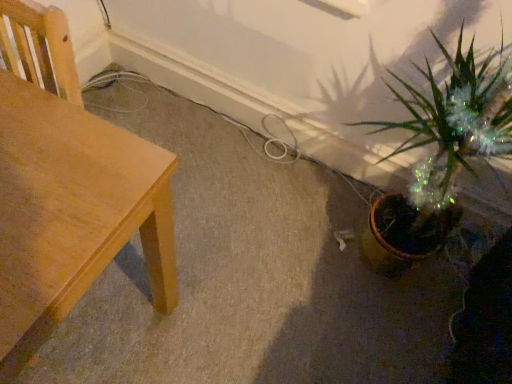
Find the location of a particular element. This screenshot has width=512, height=384. light brown wood table at left is located at coordinates (72, 212).

What do you see at coordinates (72, 212) in the screenshot? I see `light brown wood table at left` at bounding box center [72, 212].

At what (x,y) coordinates should I click in order to perform the action: click on light brown wood table at left. Please return your answer as a coordinate pair (x, y). Looking at the image, I should click on (72, 212).